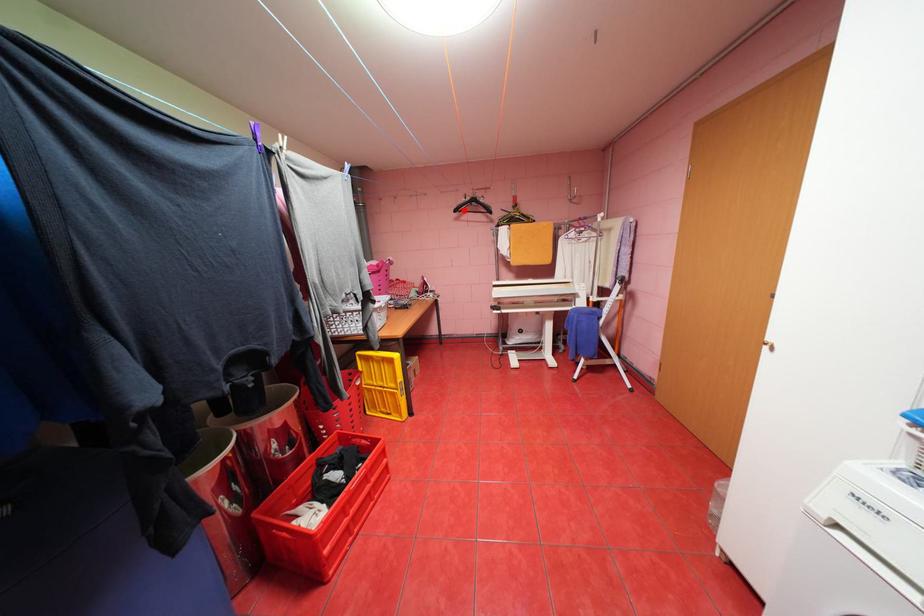
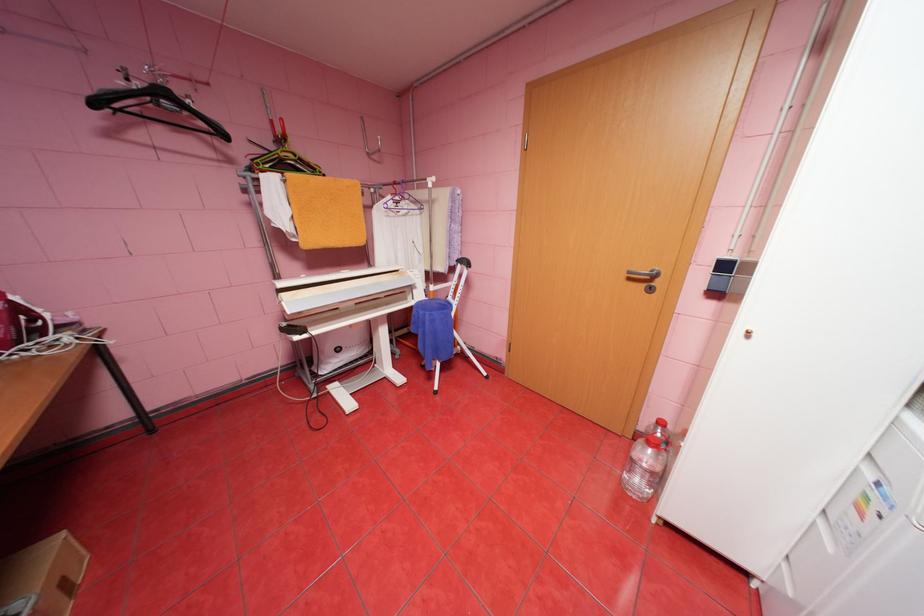
Locate, in the second image, the point that corresponds to the highlighted location in the first image.

(103, 103)